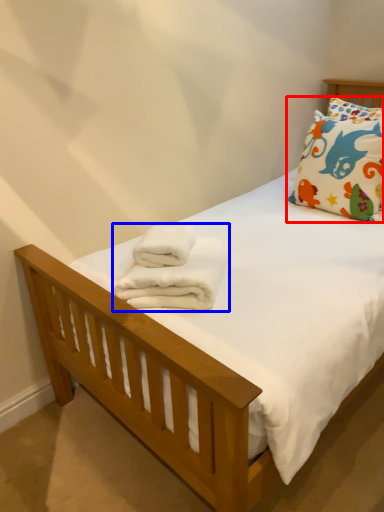
Question: Which object is closer to the camera taking this photo, pillow (highlighted by a red box) or bath towel (highlighted by a blue box)?

Choices:
 (A) pillow
 (B) bath towel

Answer: (B)